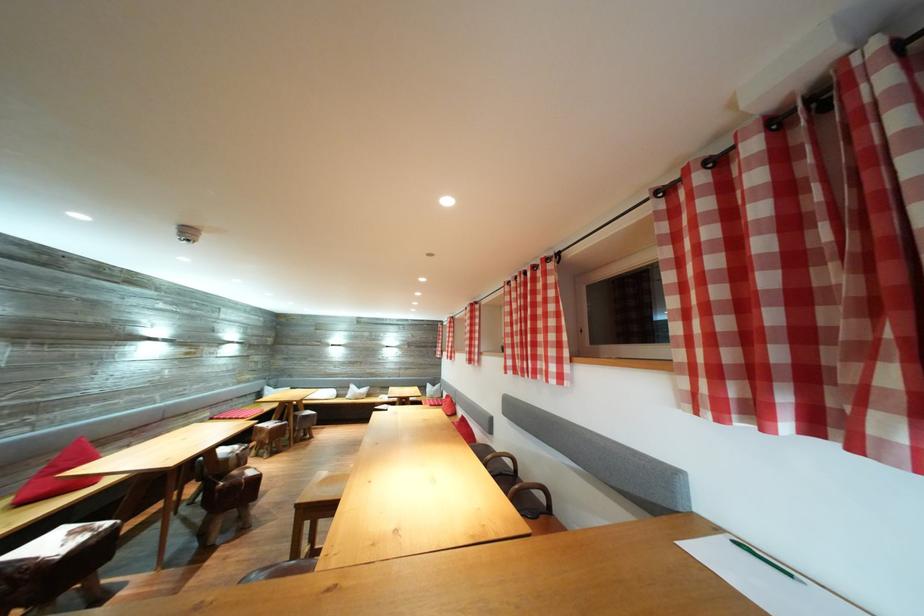
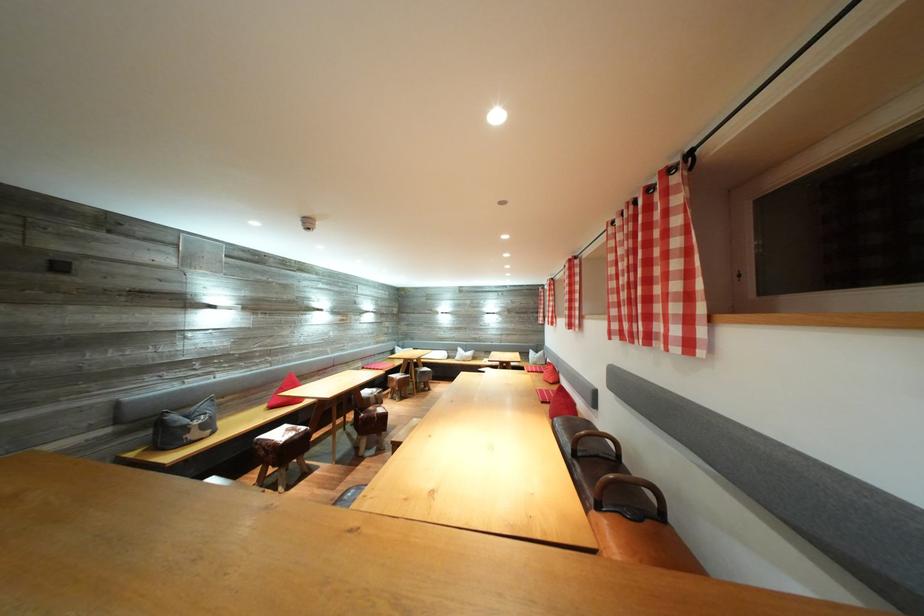
Locate, in the second image, the point that corresponds to point (517, 368) in the first image.

(622, 331)